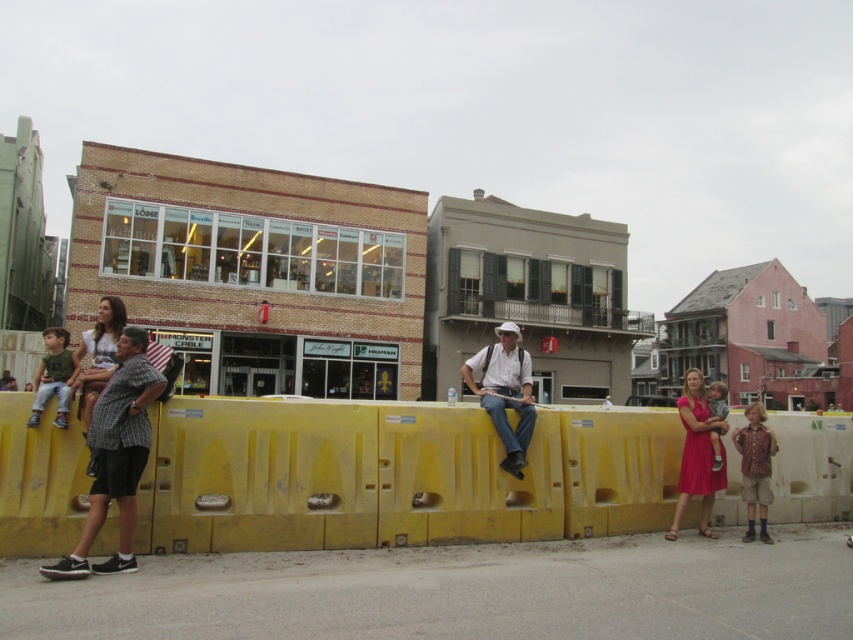
You are standing in the street scene and want to know which of the two points, point (97, 410) or point (517, 448), is closer to you. Based on the scene description, which point is nearer?

Point (97, 410) is closer to the viewer than point (517, 448).

You are a photographer trying to capture a clear shot of both the matte white hat at center and the matte pink dress at center in the scene. Since you want to ensure both are visible in your frame, which object should you adjust your focus on to account for their height difference?

The matte white hat at center is not as tall as the matte pink dress at center, so you should focus on the taller matte pink dress at center to ensure both are visible in the frame.